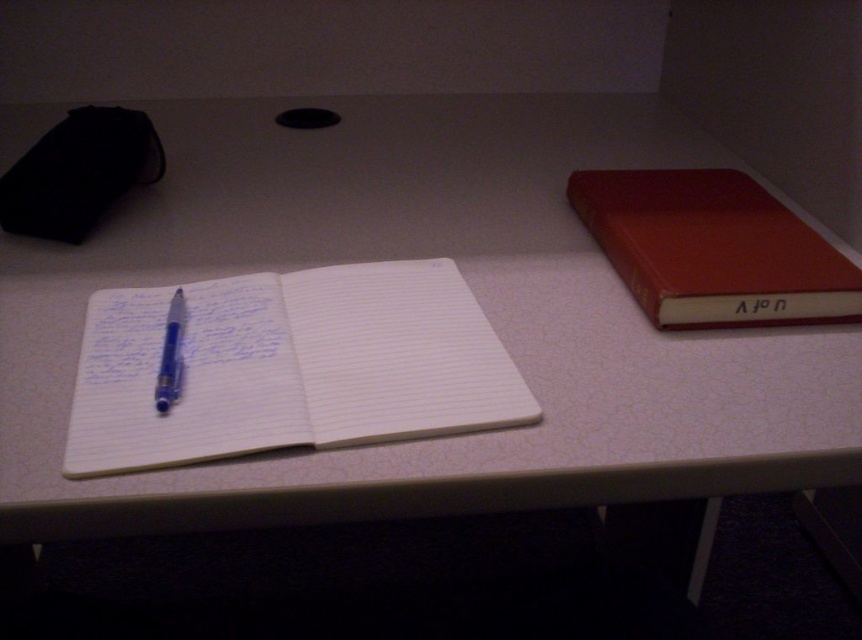
Does white lined paper at center appear under red leather book at right?

Yes, white lined paper at center is below red leather book at right.

Does white lined paper at center have a lesser height compared to red leather book at right?

Yes.

Is point (348, 440) more distant than point (689, 177)?

No, (348, 440) is in front of (689, 177).

This screenshot has height=640, width=862. I want to click on white lined paper at center, so click(291, 365).

Consider the image. Who is taller, red leather book at right or blue glossy pen at center?

Standing taller between the two is red leather book at right.

Which is more to the right, red leather book at right or blue glossy pen at center?

From the viewer's perspective, red leather book at right appears more on the right side.

Which is in front, point (610, 202) or point (179, 372)?

Point (179, 372) is in front.

At what (x,y) coordinates should I click in order to perform the action: click on red leather book at right. Please return your answer as a coordinate pair (x, y). Looking at the image, I should click on (711, 248).

Is white lined paper at center behind blue glossy pen at center?

No, it is in front of blue glossy pen at center.

Image resolution: width=862 pixels, height=640 pixels. Describe the element at coordinates (291, 365) in the screenshot. I see `white lined paper at center` at that location.

Between point (478, 426) and point (170, 374), which one is positioned behind?

Positioned behind is point (170, 374).

In order to click on white lined paper at center in this screenshot , I will do `click(291, 365)`.